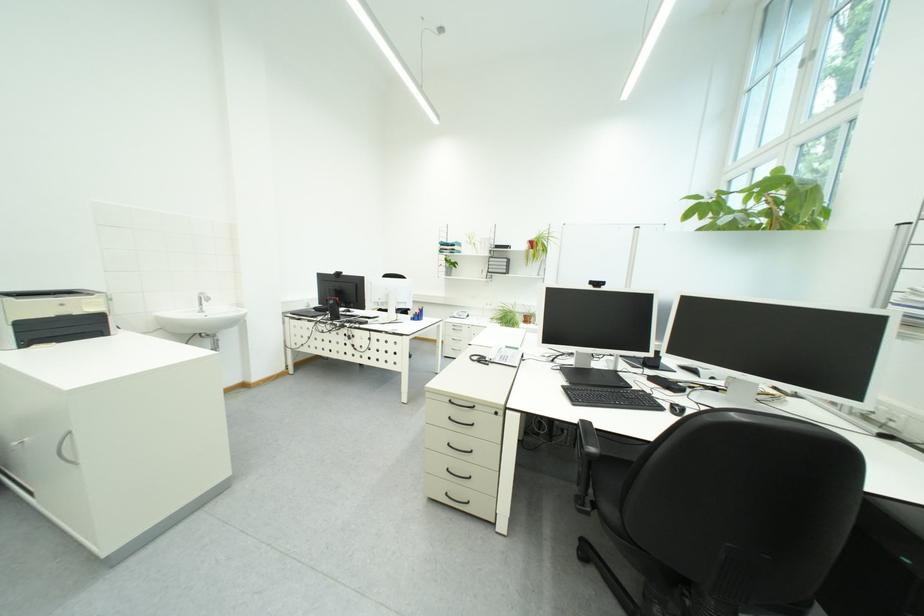
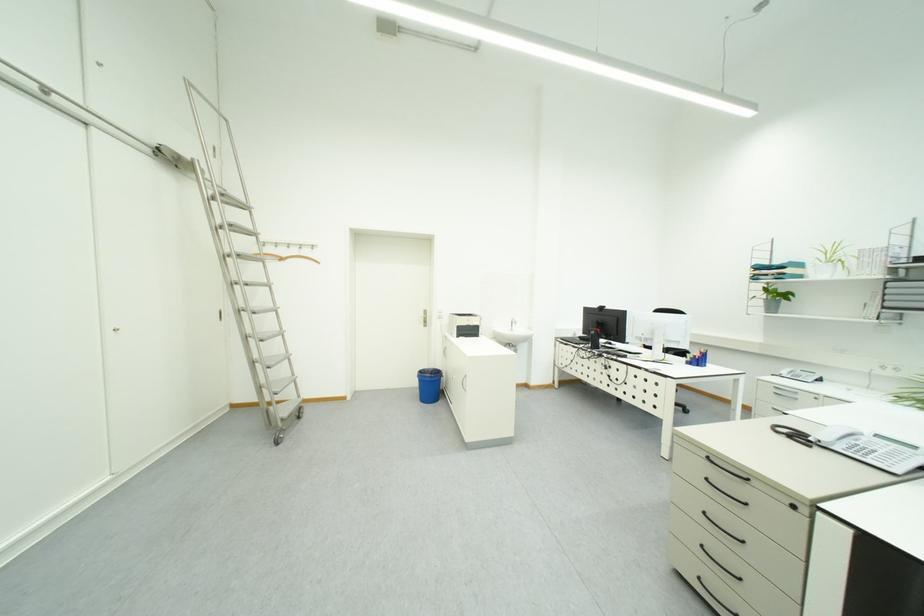
Question: The first image is from the beginning of the video and the second image is from the end. How did the camera likely rotate when shooting the video?

Choices:
 (A) Left
 (B) Right
 (C) Up
 (D) Down

Answer: (A)